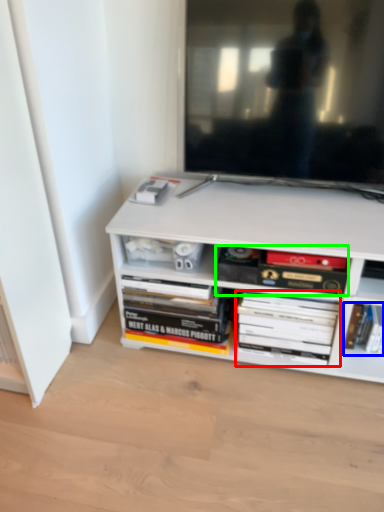
Question: Which object is positioned farthest from book (highlighted by a red box)? Select from book (highlighted by a blue box) and book (highlighted by a green box).

Choices:
 (A) book
 (B) book

Answer: (A)